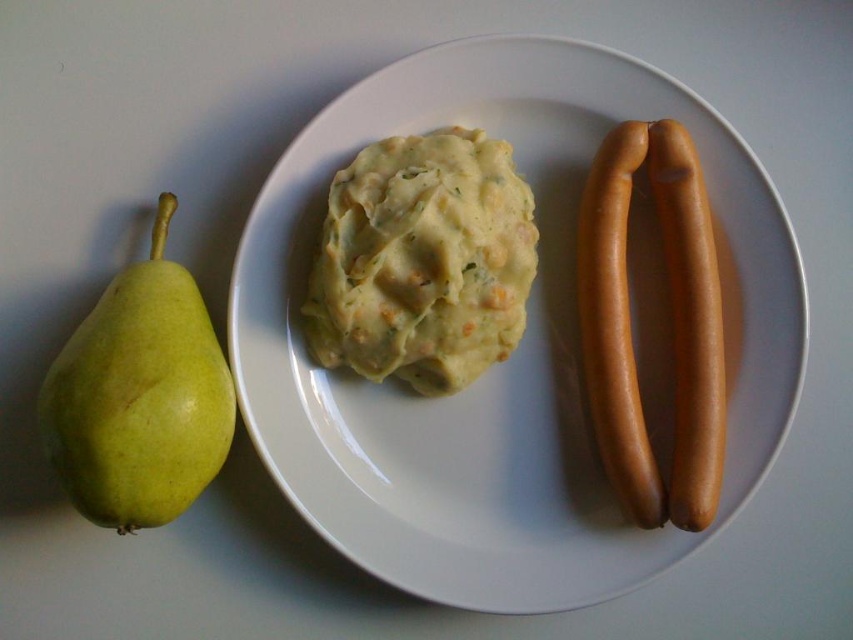
Is point (480, 176) positioned in front of point (633, 481)?

No, it is behind (633, 481).

Who is more forward, (473, 324) or (695, 488)?

Point (695, 488) is in front.

Between point (467, 212) and point (645, 484), which one is positioned behind?

The point (467, 212) is behind.

Find the location of a particular element. The height and width of the screenshot is (640, 853). yellow creamy mashed potato at center is located at coordinates (422, 260).

Which of these two, white glossy plate at center or brown smooth hot dog at right, stands shorter?

brown smooth hot dog at right

Between white glossy plate at center and brown smooth hot dog at right, which one has more height?

white glossy plate at center is taller.

Between point (759, 193) and point (627, 502), which one is positioned in front?

Point (759, 193) is more forward.

Locate an element on the screen. white glossy plate at center is located at coordinates (514, 353).

Does white glossy plate at center have a lesser height compared to yellow creamy mashed potato at center?

Incorrect, white glossy plate at center's height does not fall short of yellow creamy mashed potato at center's.

Can you confirm if white glossy plate at center is bigger than yellow creamy mashed potato at center?

Yes, white glossy plate at center is bigger than yellow creamy mashed potato at center.

Who is more distant from viewer, (300, 196) or (524, 253)?

Point (524, 253)

This screenshot has width=853, height=640. Identify the location of white glossy plate at center. (514, 353).